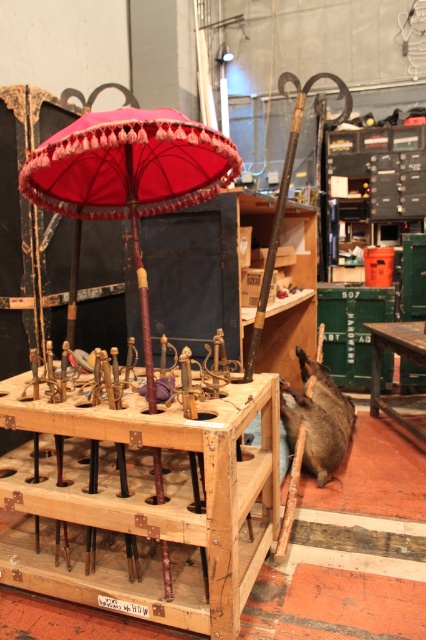
Question: Which of the following is the farthest from the observer?

Choices:
 (A) velvet pink parasol at center
 (B) wooden at center

Answer: (B)

Question: Can you confirm if wooden at center is wider than velvet pink parasol at center?

Choices:
 (A) no
 (B) yes

Answer: (B)

Question: Observing the image, what is the correct spatial positioning of wooden at center in reference to velvet pink parasol at center?

Choices:
 (A) right
 (B) left

Answer: (B)

Question: Is wooden at center bigger than velvet pink parasol at center?

Choices:
 (A) yes
 (B) no

Answer: (B)